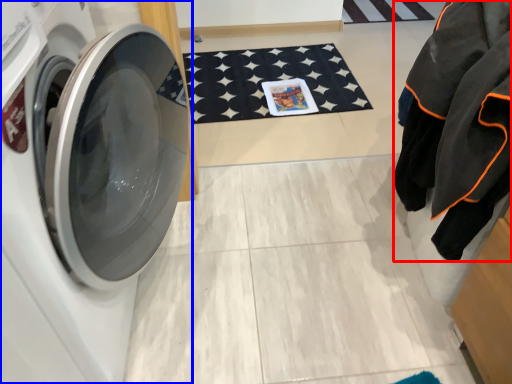
Question: Among these objects, which one is farthest to the camera, clothing (highlighted by a red box) or washing machine (highlighted by a blue box)?

Choices:
 (A) clothing
 (B) washing machine

Answer: (A)